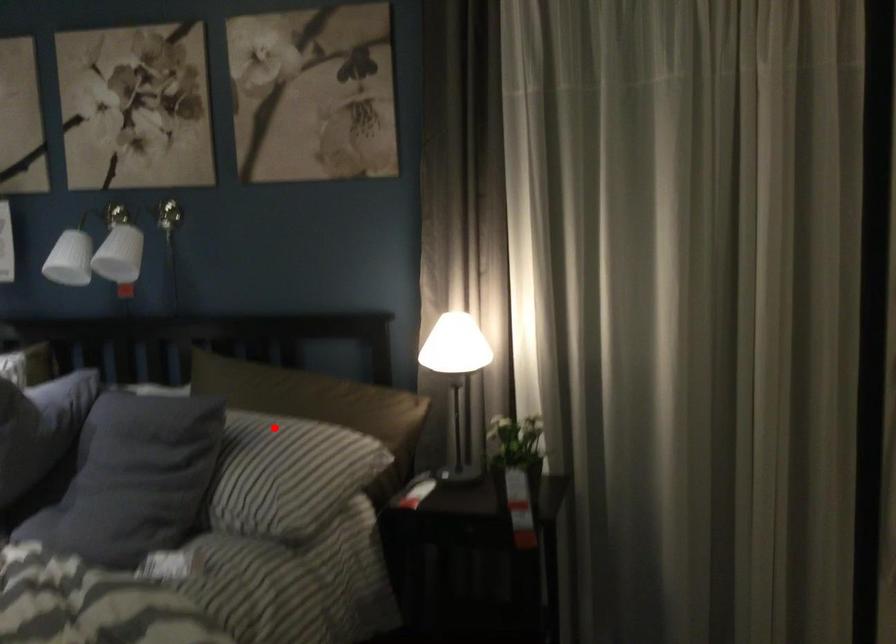
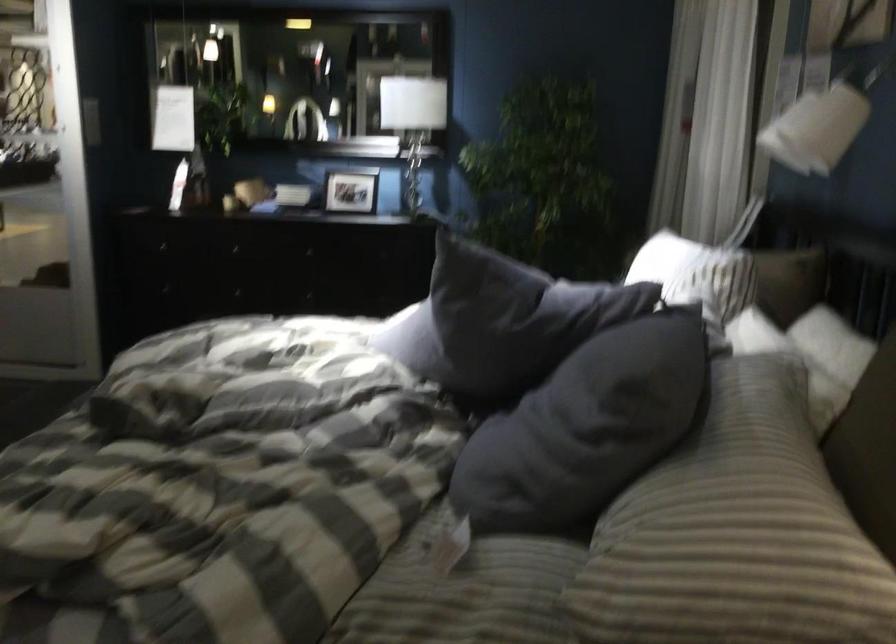
Where in the second image is the point corresponding to the highlighted location from the first image?

(760, 453)